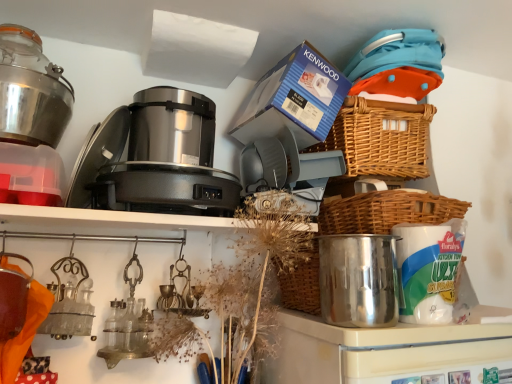
Question: From a real-world perspective, is shiny metallic pot at center-right, which is the second appliance in left-to-right order, below blue cardboard box at upper center?

Choices:
 (A) no
 (B) yes

Answer: (B)

Question: Is shiny metallic pot at center-right, the 1th appliance in the front-to-back sequence, oriented towards blue cardboard box at upper center?

Choices:
 (A) yes
 (B) no

Answer: (B)

Question: Is shiny metallic pot at center-right, which is the second appliance in left-to-right order, looking in the opposite direction of blue cardboard box at upper center?

Choices:
 (A) yes
 (B) no

Answer: (B)

Question: Are shiny metallic pot at center-right, the first appliance when ordered from bottom to top, and blue cardboard box at upper center far apart?

Choices:
 (A) no
 (B) yes

Answer: (A)

Question: Is shiny metallic pot at center-right, acting as the second appliance starting from the back, at the right side of blue cardboard box at upper center?

Choices:
 (A) no
 (B) yes

Answer: (B)

Question: Is satin metallic food processor at center, which is the first appliance from top to bottom, taller or shorter than woven brown basket at upper right, acting as the second basket starting from the bottom?

Choices:
 (A) tall
 (B) short

Answer: (B)

Question: Would you say satin metallic food processor at center, placed as the first appliance when sorted from back to front, is to the left or to the right of woven brown basket at upper right, acting as the second basket starting from the bottom, in the picture?

Choices:
 (A) right
 (B) left

Answer: (B)

Question: From the image's perspective, is satin metallic food processor at center, which is the first appliance from top to bottom, located above or below woven brown basket at upper right, the 1th basket when ordered from top to bottom?

Choices:
 (A) below
 (B) above

Answer: (B)

Question: Is satin metallic food processor at center, which is the 2th appliance from bottom to top, inside the boundaries of woven brown basket at upper right, acting as the second basket starting from the bottom, or outside?

Choices:
 (A) outside
 (B) inside

Answer: (A)

Question: Is point (292, 178) positioned closer to the camera than point (337, 200)?

Choices:
 (A) closer
 (B) farther

Answer: (A)

Question: Is blue cardboard box at upper center situated inside woven brown basket at right, the 2th basket from the top, or outside?

Choices:
 (A) outside
 (B) inside

Answer: (A)

Question: Based on their sizes in the image, would you say blue cardboard box at upper center is bigger or smaller than woven brown basket at right, the 2th basket from the top?

Choices:
 (A) small
 (B) big

Answer: (B)

Question: Looking at their shapes, would you say blue cardboard box at upper center is wider or thinner than woven brown basket at right, arranged as the first basket when ordered from the bottom?

Choices:
 (A) thin
 (B) wide

Answer: (B)

Question: In the image, is blue cardboard box at upper center positioned in front of or behind woven brown basket at upper right, the 1th basket when ordered from top to bottom?

Choices:
 (A) front
 (B) behind

Answer: (A)

Question: Does point (276, 94) appear closer or farther from the camera than point (371, 102)?

Choices:
 (A) closer
 (B) farther

Answer: (A)